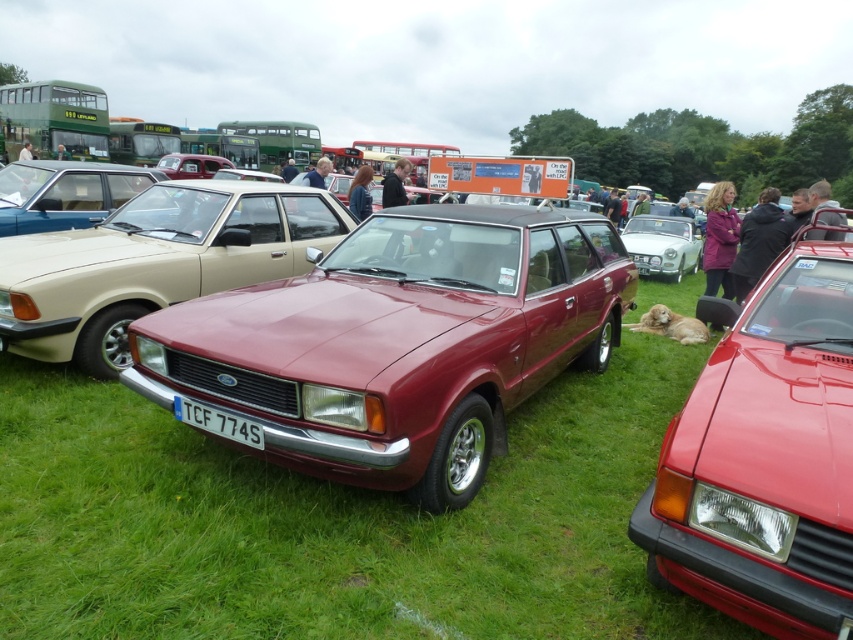
Question: Among these objects, which one is nearest to the camera?

Choices:
 (A) white plastic license plate at center
 (B) satin beige station wagon at left

Answer: (A)

Question: Does satin burgundy station wagon at center appear over white plastic license plate at center?

Choices:
 (A) no
 (B) yes

Answer: (B)

Question: Does maroon metallic station wagon at center come behind satin beige station wagon at left?

Choices:
 (A) no
 (B) yes

Answer: (A)

Question: Which of these objects is positioned farthest from the white plastic license plate at center?

Choices:
 (A) satin beige station wagon at left
 (B) shiny red car at center
 (C) satin burgundy station wagon at center
 (D) maroon metallic station wagon at center

Answer: (A)

Question: Is white glossy car at center thinner than white plastic license plate at center?

Choices:
 (A) no
 (B) yes

Answer: (A)

Question: Which point is farther from the camera taking this photo?

Choices:
 (A) (26, 227)
 (B) (218, 416)
 (C) (636, 262)
 (D) (819, 515)

Answer: (C)